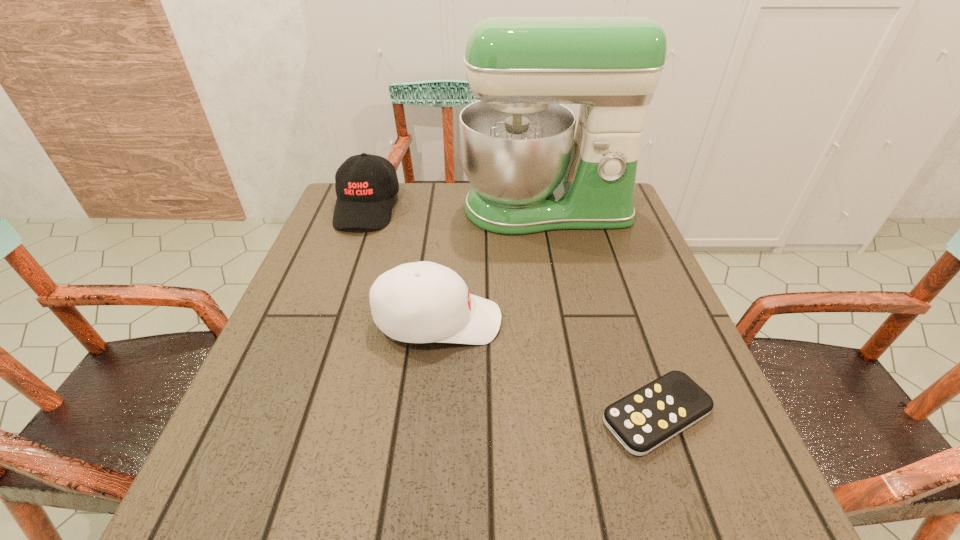
Find the location of a particular element. The image size is (960, 540). vacant point located between the third farthest object and the tallest object is located at coordinates (492, 265).

Image resolution: width=960 pixels, height=540 pixels. In order to click on unoccupied area between the farther baseball cap and the mixer in this screenshot , I will do `click(456, 208)`.

Locate which object is the closest to the leftmost object. Please provide its 2D coordinates. Your answer should be formatted as a tuple, i.e. [(x, y)], where the tuple contains the x and y coordinates of a point satisfying the conditions above.

[(530, 173)]

Find the location of `the third closest object to the third farthest object`. the third closest object to the third farthest object is located at coordinates (365, 184).

Locate an element on the screen. The image size is (960, 540). vacant point that satisfies the following two spatial constraints: 1. on the front-facing side of the right baseball cap; 2. on the right side of the nearest object is located at coordinates (429, 415).

This screenshot has width=960, height=540. I want to click on free space that satisfies the following two spatial constraints: 1. on the controls of the tallest object; 2. on the front-facing side of the right baseball cap, so click(x=569, y=321).

The width and height of the screenshot is (960, 540). I want to click on free location that satisfies the following two spatial constraints: 1. on the controls of the mixer; 2. on the front-facing side of the third farthest object, so click(569, 321).

Image resolution: width=960 pixels, height=540 pixels. Find the location of `free space that satisfies the following two spatial constraints: 1. on the front-facing side of the nearer baseball cap; 2. on the left side of the remote control`. free space that satisfies the following two spatial constraints: 1. on the front-facing side of the nearer baseball cap; 2. on the left side of the remote control is located at coordinates (429, 415).

You are a GUI agent. You are given a task and a screenshot of the screen. Output one action in this format:
    pyautogui.click(x=<x>, y=<y>)
    Task: Click on the vacant region that satisfies the following two spatial constraints: 1. on the front-facing side of the right baseball cap; 2. on the back side of the nearest object
    
    Given the screenshot: What is the action you would take?
    pyautogui.click(x=429, y=415)

At what (x,y) coordinates should I click in order to perform the action: click on vacant space that satisfies the following two spatial constraints: 1. on the controls of the mixer; 2. on the front-facing side of the nearer baseball cap. Please return your answer as a coordinate pair (x, y). Looking at the image, I should click on (569, 321).